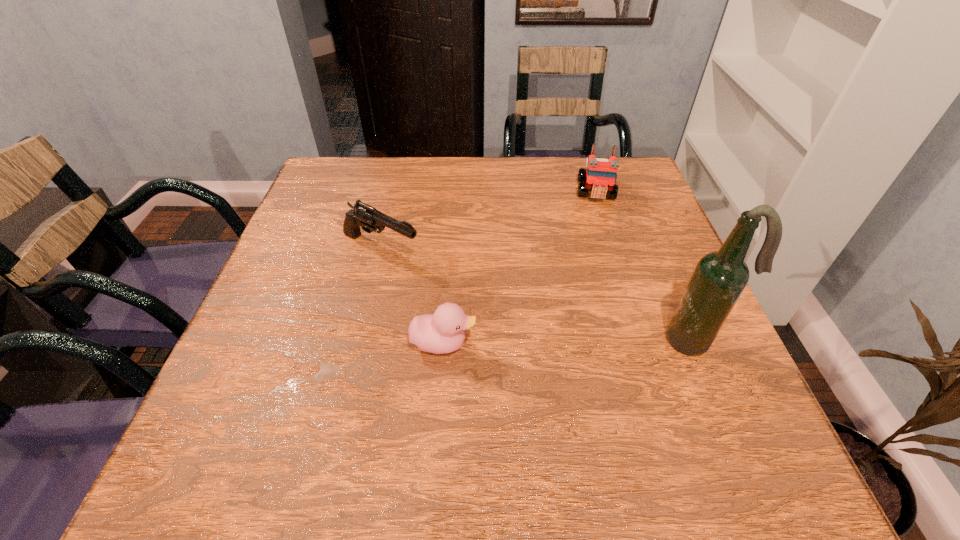
Identify the location of free spot on the desktop that is between the duckling and the beer bottle and is positioned at the end of the barrel of the second farthest object. The image size is (960, 540). 561,342.

Image resolution: width=960 pixels, height=540 pixels. What are the coordinates of `free space on the desktop that is between the duckling and the beer bottle and is positioned on the front-facing side of the Lego` in the screenshot? It's located at (603, 341).